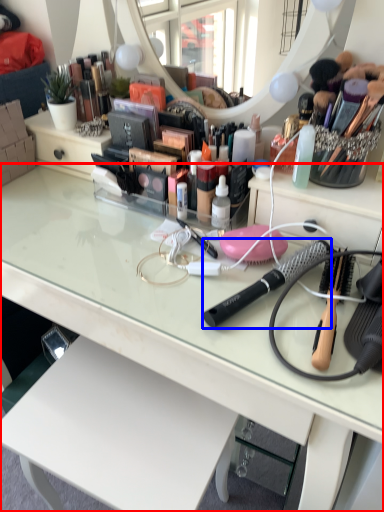
Question: Which object appears farthest to the camera in this image, desk (highlighted by a red box) or brush (highlighted by a blue box)?

Choices:
 (A) desk
 (B) brush

Answer: (B)